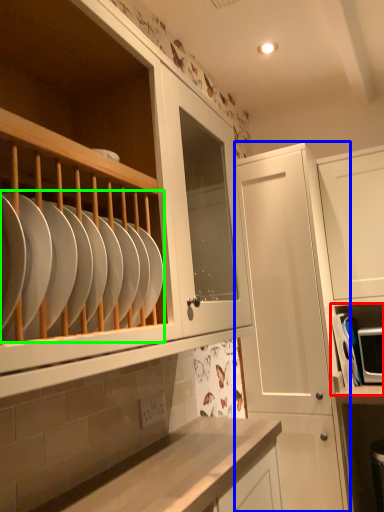
Question: Which object is the closest to the shelf (highlighted by a red box)? Choose among these: cabinetry (highlighted by a blue box) or tableware (highlighted by a green box).

Choices:
 (A) cabinetry
 (B) tableware

Answer: (A)